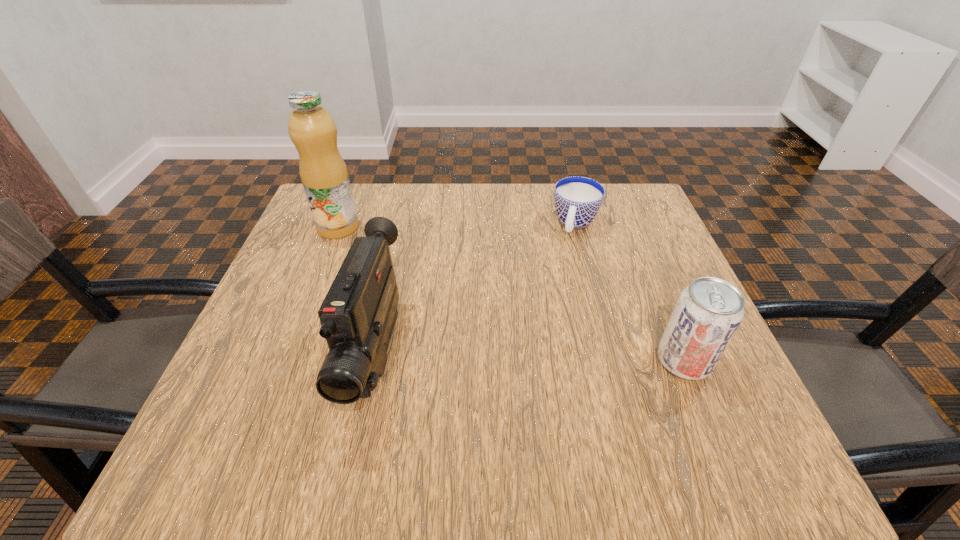
Find the location of a particular element. free space located 0.370m on the side of the second object from right to left with the handle is located at coordinates (530, 360).

The height and width of the screenshot is (540, 960). I want to click on vacant space located on the side of the second object from right to left with the handle, so click(566, 255).

Where is `vacant area situated on the front label of the leftmost object`? This screenshot has height=540, width=960. vacant area situated on the front label of the leftmost object is located at coordinates (399, 272).

You are a GUI agent. You are given a task and a screenshot of the screen. Output one action in this format:
    pyautogui.click(x=<x>, y=<y>)
    Task: Click on the free space located 0.250m on the front label of the leftmost object
    
    Given the screenshot: What is the action you would take?
    pyautogui.click(x=418, y=284)

Identify the location of free space located 0.360m on the front label of the leftmost object. The image size is (960, 540). (453, 309).

This screenshot has width=960, height=540. I want to click on cup located at the far edge, so click(577, 199).

Locate an element on the screen. fruit juice located at the far edge is located at coordinates (324, 175).

Identify the location of camcorder situated at the near edge. The width and height of the screenshot is (960, 540). (357, 316).

The width and height of the screenshot is (960, 540). I want to click on soda can situated at the near edge, so click(x=708, y=312).

Locate an element on the screen. The width and height of the screenshot is (960, 540). object that is positioned at the left edge is located at coordinates (324, 175).